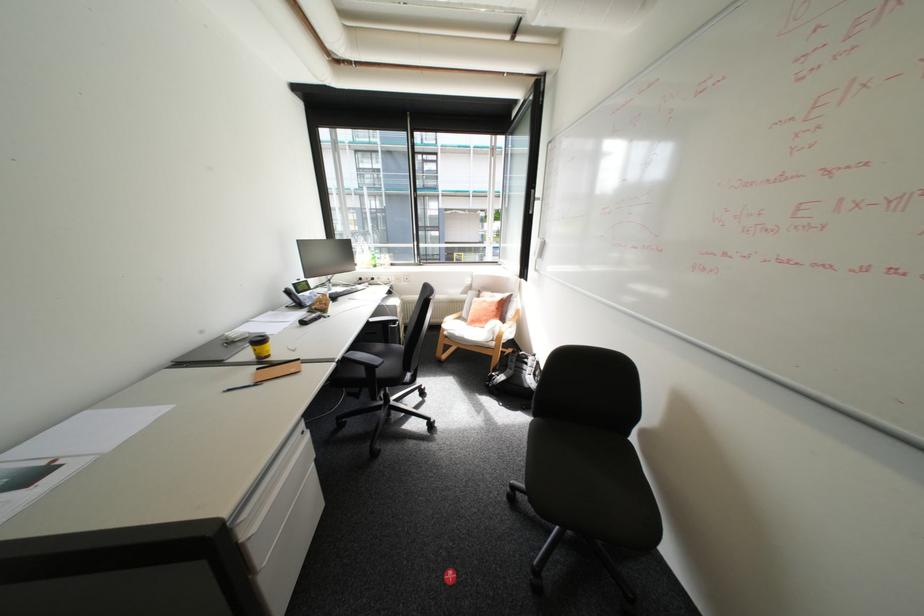
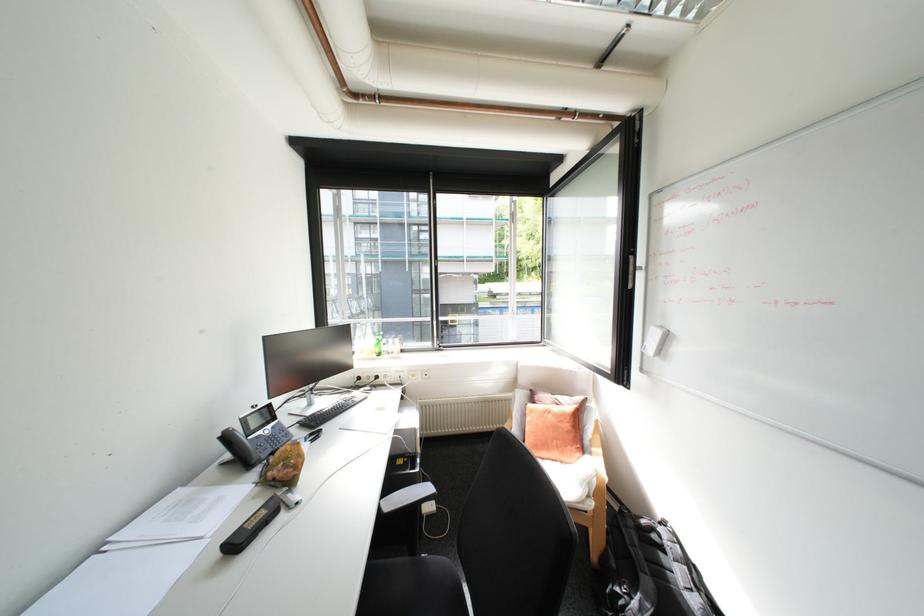
Locate, in the second image, the point that corresponds to pixel 378 265 in the first image.

(379, 354)